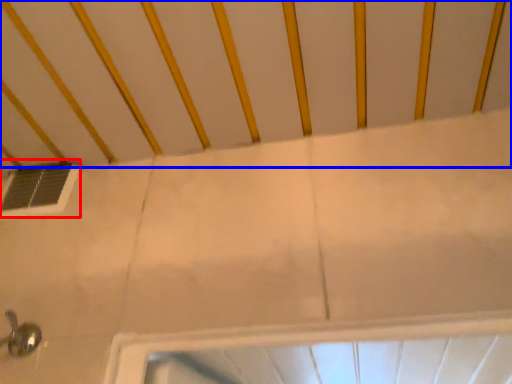
Question: Which point is closer to the camera, window (highlighted by a red box) or infant bed (highlighted by a blue box)?

Choices:
 (A) window
 (B) infant bed

Answer: (B)